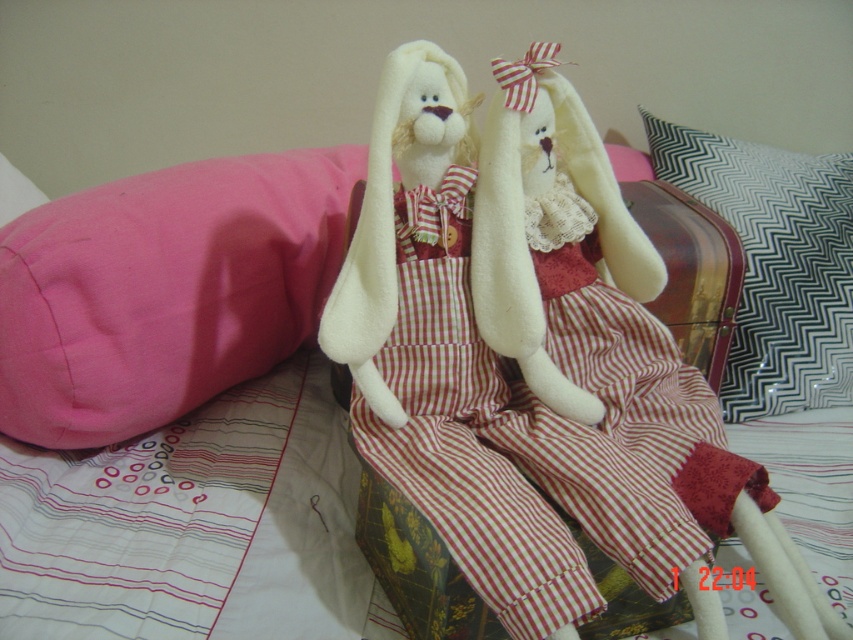
Who is higher up, pink fabric pillow at left or black and white zigzag pillow at upper right?

black and white zigzag pillow at upper right

Is pink fabric pillow at left positioned before black and white zigzag pillow at upper right?

Yes, it is in front of black and white zigzag pillow at upper right.

Is point (239, 301) positioned in front of point (817, 355)?

That is True.

Where is `pink fabric pillow at left`? pink fabric pillow at left is located at coordinates (164, 291).

Who is lower down, red plaid fabric dress at center or pink fabric pillow at left?

Positioned lower is red plaid fabric dress at center.

Measure the distance between red plaid fabric dress at center and pink fabric pillow at left.

9.96 inches

Is point (410, 572) in front of point (41, 380)?

Yes.

Image resolution: width=853 pixels, height=640 pixels. What are the coordinates of `red plaid fabric dress at center` in the screenshot? It's located at (502, 470).

Who is more distant from viewer, [410,387] or [729,400]?

Positioned behind is point [729,400].

What are the coordinates of `red plaid fabric dress at center` in the screenshot? It's located at (502, 470).